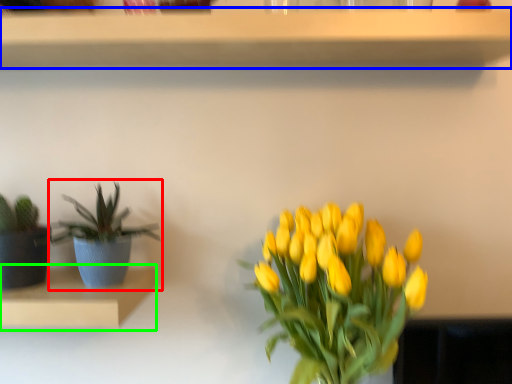
Question: Which object is the closest to the houseplant (highlighted by a red box)? Choose among these: shelf (highlighted by a blue box) or shelf (highlighted by a green box).

Choices:
 (A) shelf
 (B) shelf

Answer: (B)